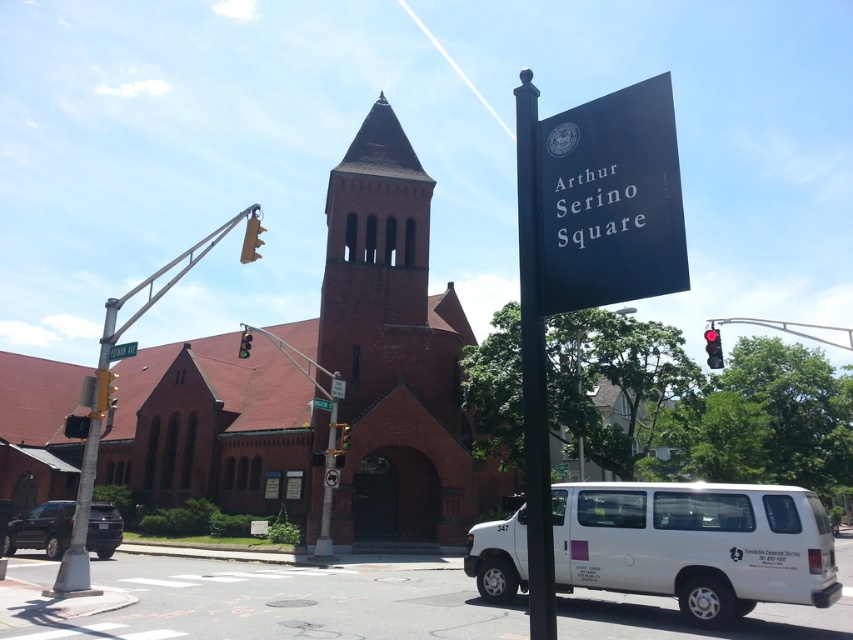
You are a delivery driver who needs to deliver a package to the church. You are currently at the green plastic street sign at center. Which direction should you head to reach the church?

The green plastic street sign at center is located at point (337, 388), so you should head towards the church which is at the center of the image.

You are standing on the street looking at the church. There are two points marked on the image. The first point is at coordinates point (340, 385) and the second is at point (349, 432). Which point is nearer to you?

Point (340, 385) is closer to the camera than point (349, 432), so the first point is nearer to you.